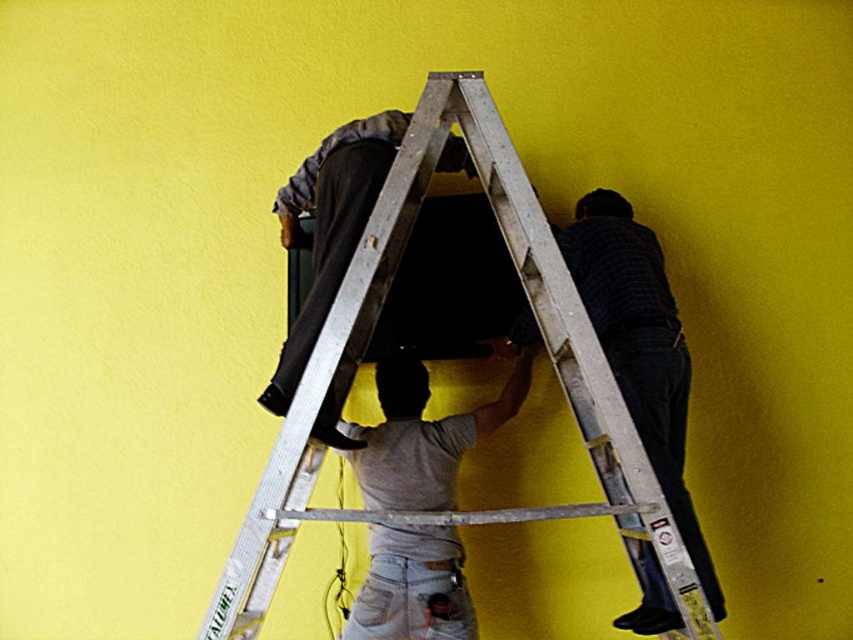
Question: Which object is positioned farthest from the gray matte fabric at center?

Choices:
 (A) dark gray fabric at upper right
 (B) silver metallic ladder at center
 (C) matte black tv at center

Answer: (A)

Question: Is silver metallic ladder at center in front of matte black tv at center?

Choices:
 (A) yes
 (B) no

Answer: (A)

Question: Is dark gray fabric at upper right to the right of gray matte fabric at center from the viewer's perspective?

Choices:
 (A) yes
 (B) no

Answer: (A)

Question: Which point appears closest to the camera in this image?

Choices:
 (A) (373, 589)
 (B) (680, 422)
 (C) (410, 246)

Answer: (A)

Question: Which object is the farthest from the matte black tv at center?

Choices:
 (A) dark gray fabric at upper right
 (B) silver metallic ladder at center

Answer: (A)

Question: In this image, where is dark gray fabric at upper right located relative to gray matte fabric at center?

Choices:
 (A) below
 (B) above

Answer: (B)